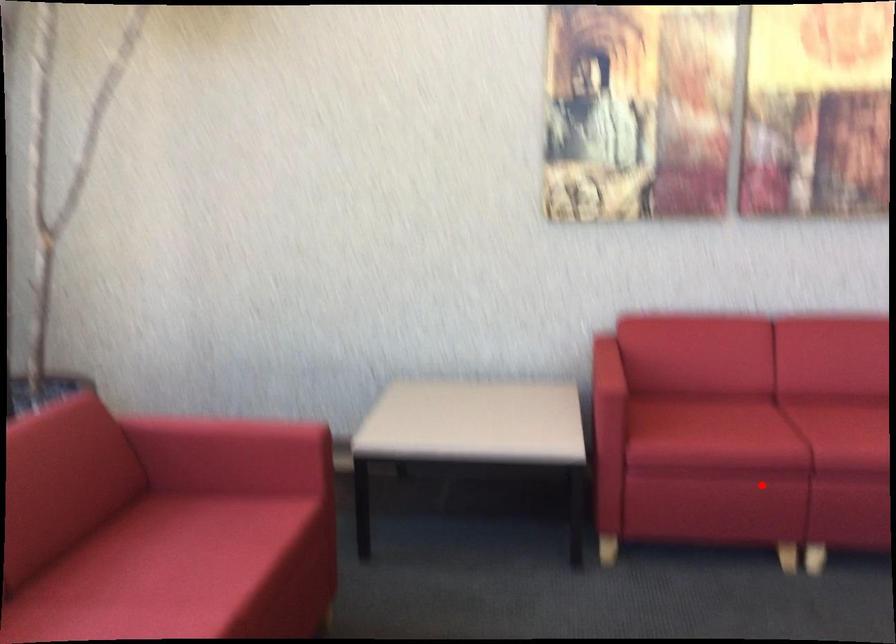
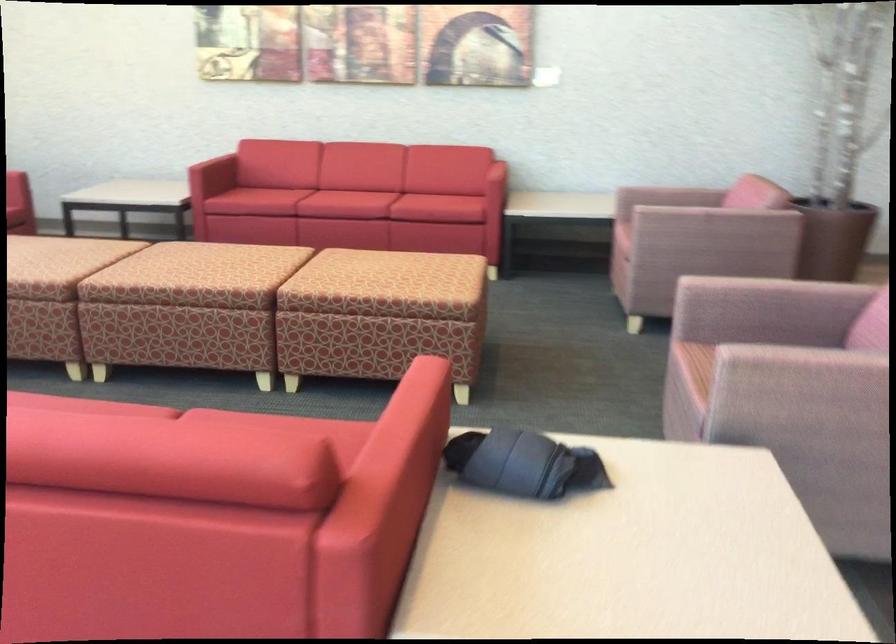
Question: A red point is marked in image1. In image2, is the corresponding 3D point closer to the camera or farther? Reply with the corresponding letter.

Choices:
 (A) The corresponding 3D point is closer.
 (B) The corresponding 3D point is farther.

Answer: (B)